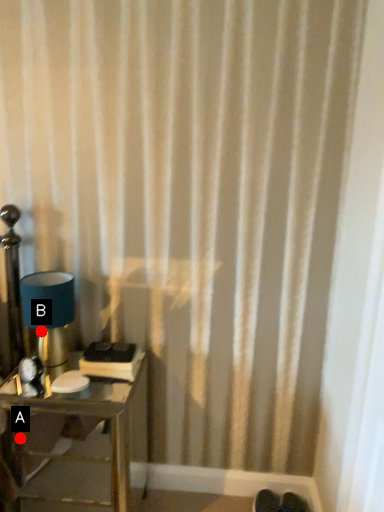
Question: Two points are circled on the image, labeled by A and B beside each circle. Which of the following is the farthest from the observer?

Choices:
 (A) A is further
 (B) B is further

Answer: (A)